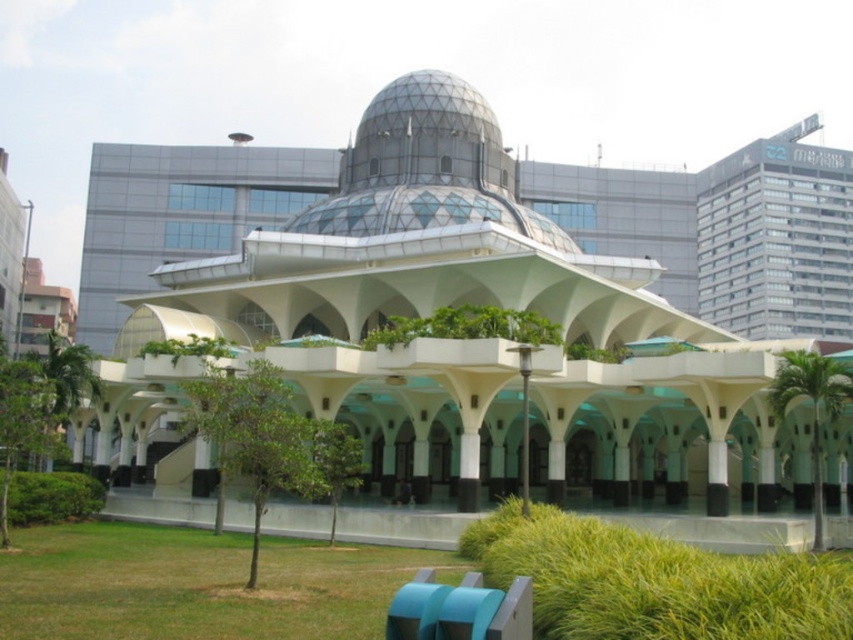
Is green grass at lower left wider than green grass at lower center?

Indeed, green grass at lower left has a greater width compared to green grass at lower center.

Does green grass at lower left have a lesser width compared to green grass at lower center?

In fact, green grass at lower left might be wider than green grass at lower center.

You are a GUI agent. You are given a task and a screenshot of the screen. Output one action in this format:
    pyautogui.click(x=<x>, y=<y>)
    Task: Click on the green grass at lower left
    The width and height of the screenshot is (853, 640).
    Given the screenshot: What is the action you would take?
    click(x=198, y=584)